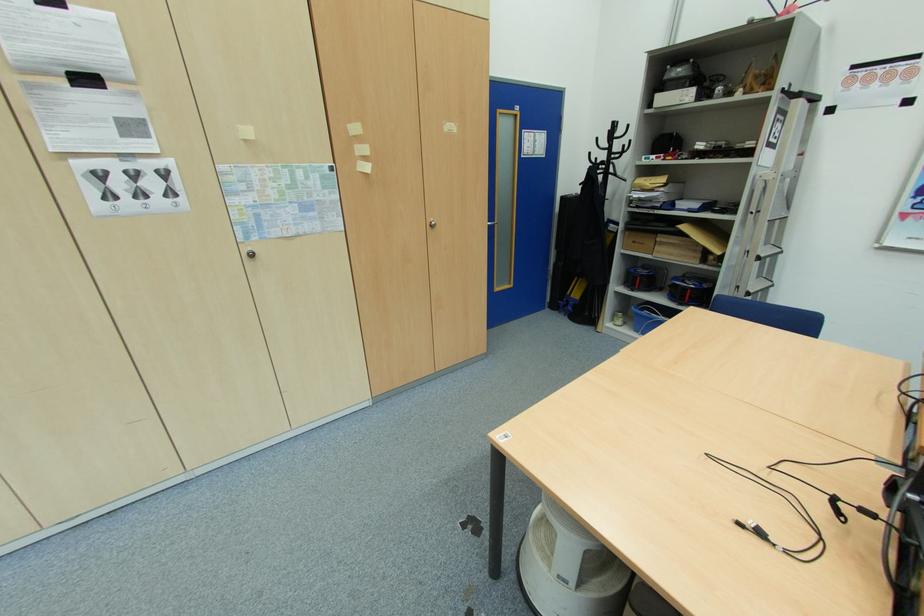
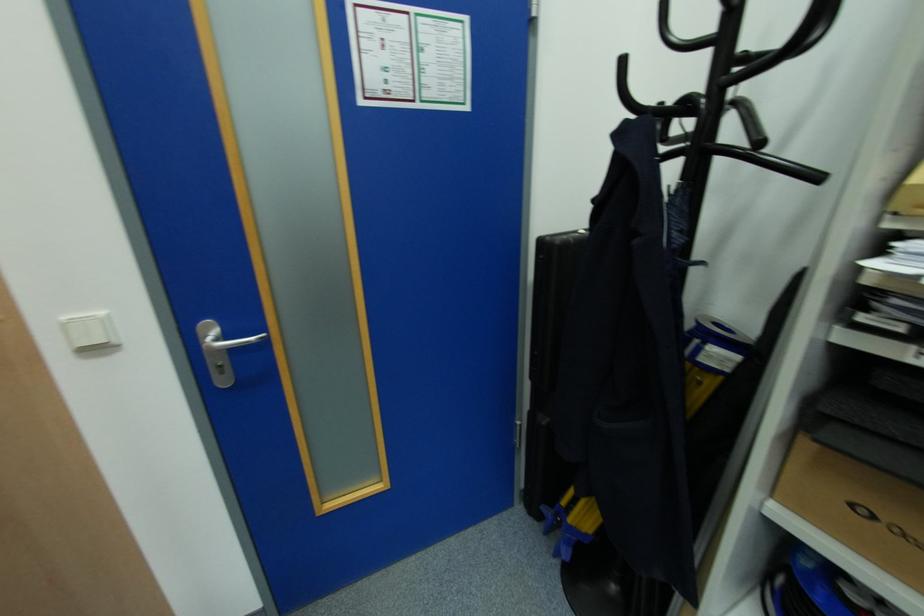
Locate, in the second image, the point that corresponds to (565,265) in the first image.

(548, 421)